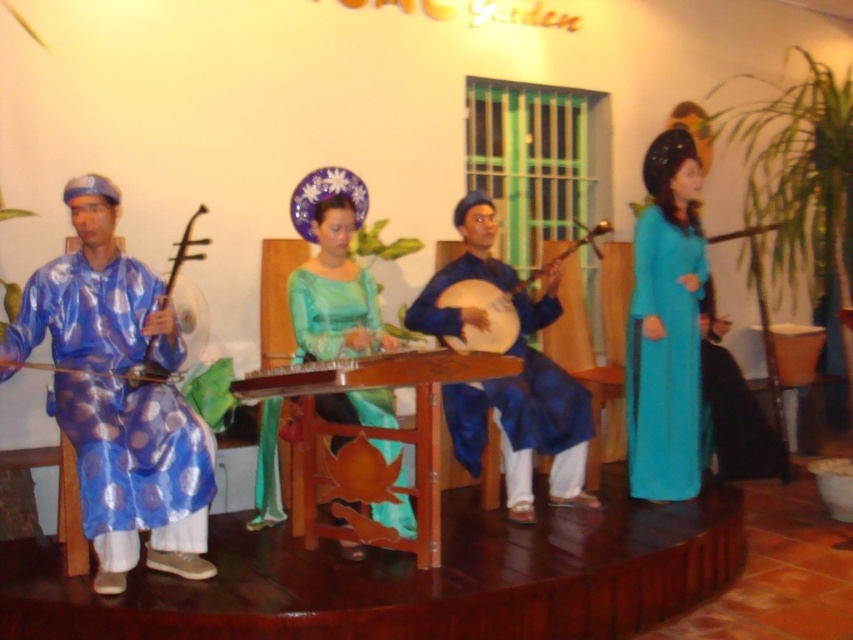
Where is the blue shiny robe at left located in the image?

The blue shiny robe at left is located at point (136, 465) in the image.

You are a music teacher who wants to arrange the wooden stringed instrument at center and the matte blue banjo at center on a shelf. If you want to place the taller instrument on the higher shelf, which one should you put there?

The matte blue banjo at center is taller than the wooden stringed instrument at center, so place the matte blue banjo at center on the higher shelf.